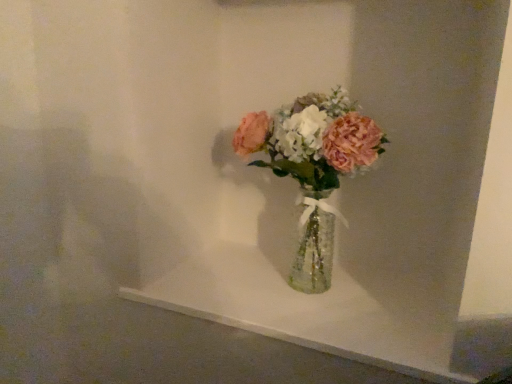
The height and width of the screenshot is (384, 512). Describe the element at coordinates (313, 167) in the screenshot. I see `translucent glass vase at center` at that location.

Measure the distance between point (370, 129) and camera.

Point (370, 129) is 34.65 inches away from camera.

You are a GUI agent. You are given a task and a screenshot of the screen. Output one action in this format:
    pyautogui.click(x=<x>, y=<y>)
    Task: Click on the translucent glass vase at center
    The image size is (512, 384).
    Given the screenshot: What is the action you would take?
    pyautogui.click(x=313, y=167)

What is the approximate height of translucent glass vase at center?

translucent glass vase at center is 18.20 inches in height.

Where is `translucent glass vase at center`? translucent glass vase at center is located at coordinates (313, 167).